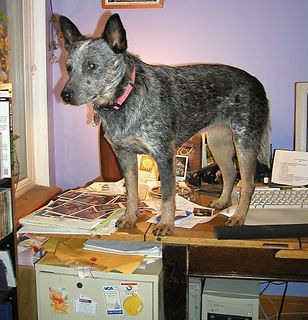
Locate an element on the screen. filing cabinet is located at coordinates (94, 292).